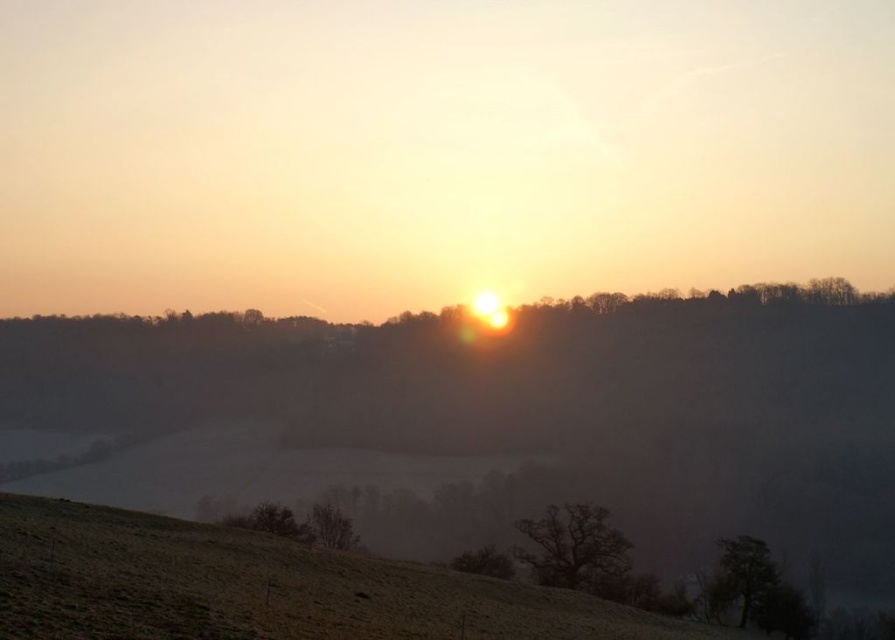
Does dark brown textured tree at lower center have a lesser height compared to green matte tree at lower left?

In fact, dark brown textured tree at lower center may be taller than green matte tree at lower left.

How much distance is there between dark brown textured tree at lower center and green matte tree at lower left?

A distance of 52.29 feet exists between dark brown textured tree at lower center and green matte tree at lower left.

Locate an element on the screen. The height and width of the screenshot is (640, 895). dark brown textured tree at lower center is located at coordinates (573, 547).

At what (x,y) coordinates should I click in order to perform the action: click on dark brown textured tree at lower center. Please return your answer as a coordinate pair (x, y). The height and width of the screenshot is (640, 895). Looking at the image, I should click on (573, 547).

Who is shorter, dark brown textured tree at lower right or brown rough tree at lower center?

dark brown textured tree at lower right is shorter.

Does point (734, 589) come closer to viewer compared to point (508, 570)?

No, it is not.

The image size is (895, 640). Identify the location of dark brown textured tree at lower right. (743, 573).

Is point (286, 516) less distant than point (350, 518)?

Yes.

Based on the photo, can you confirm if green matte tree at lower left is positioned below brown matte tree at lower center?

No.

Find the location of a particular element. The image size is (895, 640). green matte tree at lower left is located at coordinates (271, 522).